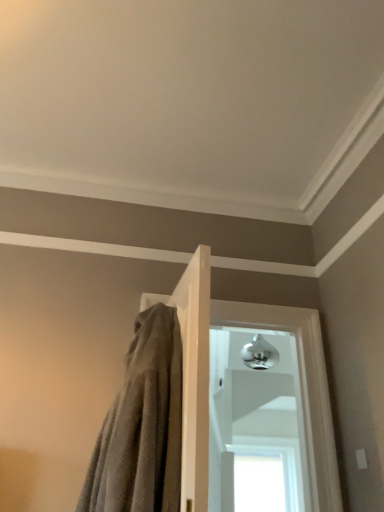
Question: Can you confirm if gray textured towel at center is thinner than transparent glass window at center, positioned as the 2th window in top-to-bottom order?

Choices:
 (A) no
 (B) yes

Answer: (A)

Question: Would you consider gray textured towel at center to be distant from transparent glass window at center, positioned as the 2th window in top-to-bottom order?

Choices:
 (A) no
 (B) yes

Answer: (B)

Question: Considering the relative positions of gray textured towel at center and transparent glass window at center, arranged as the 1th window when ordered from the bottom, in the image provided, is gray textured towel at center behind transparent glass window at center, arranged as the 1th window when ordered from the bottom,?

Choices:
 (A) yes
 (B) no

Answer: (B)

Question: Is gray textured towel at center aimed at transparent glass window at center, arranged as the 1th window when ordered from the bottom?

Choices:
 (A) yes
 (B) no

Answer: (B)

Question: Is gray textured towel at center taller than transparent glass window at center, arranged as the 1th window when ordered from the bottom?

Choices:
 (A) yes
 (B) no

Answer: (A)

Question: Does gray textured towel at center appear on the right side of transparent glass window at center, positioned as the 2th window in top-to-bottom order?

Choices:
 (A) yes
 (B) no

Answer: (B)

Question: Does polished chrome door handle at center, arranged as the first window when viewed from the top, appear on the right side of gray textured towel at center?

Choices:
 (A) yes
 (B) no

Answer: (A)

Question: Is polished chrome door handle at center, arranged as the first window when viewed from the top, in contact with gray textured towel at center?

Choices:
 (A) no
 (B) yes

Answer: (A)

Question: Is gray textured towel at center completely or partially inside polished chrome door handle at center, arranged as the first window when viewed from the top?

Choices:
 (A) no
 (B) yes

Answer: (A)

Question: Does polished chrome door handle at center, the 2th window ordered from the bottom, have a lesser width compared to gray textured towel at center?

Choices:
 (A) no
 (B) yes

Answer: (B)

Question: Is polished chrome door handle at center, the 2th window ordered from the bottom, positioned before gray textured towel at center?

Choices:
 (A) no
 (B) yes

Answer: (A)

Question: Is polished chrome door handle at center, the 2th window ordered from the bottom, outside gray textured towel at center?

Choices:
 (A) yes
 (B) no

Answer: (A)

Question: Does polished chrome door handle at center, arranged as the first window when viewed from the top, have a larger size compared to transparent glass window at center, arranged as the 1th window when ordered from the bottom?

Choices:
 (A) yes
 (B) no

Answer: (A)